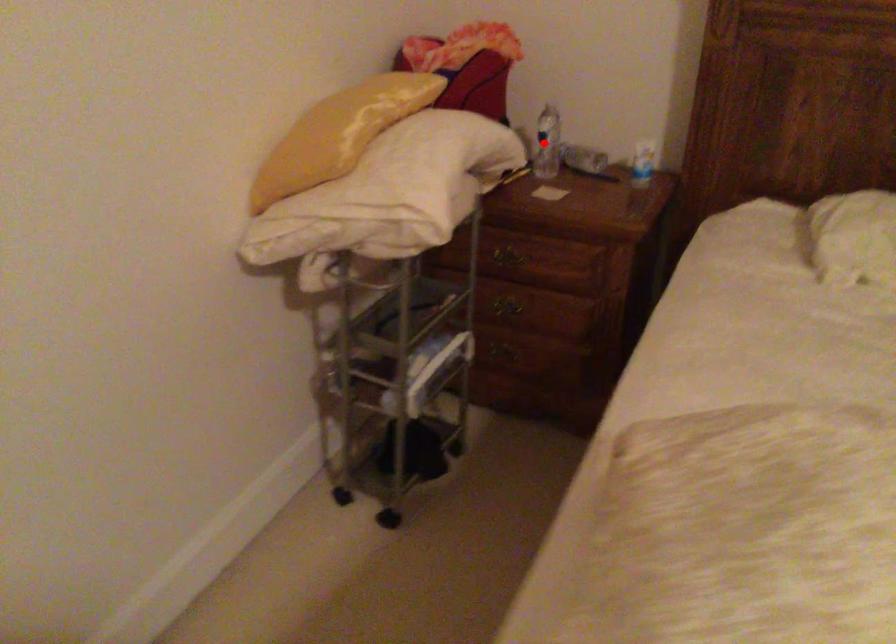
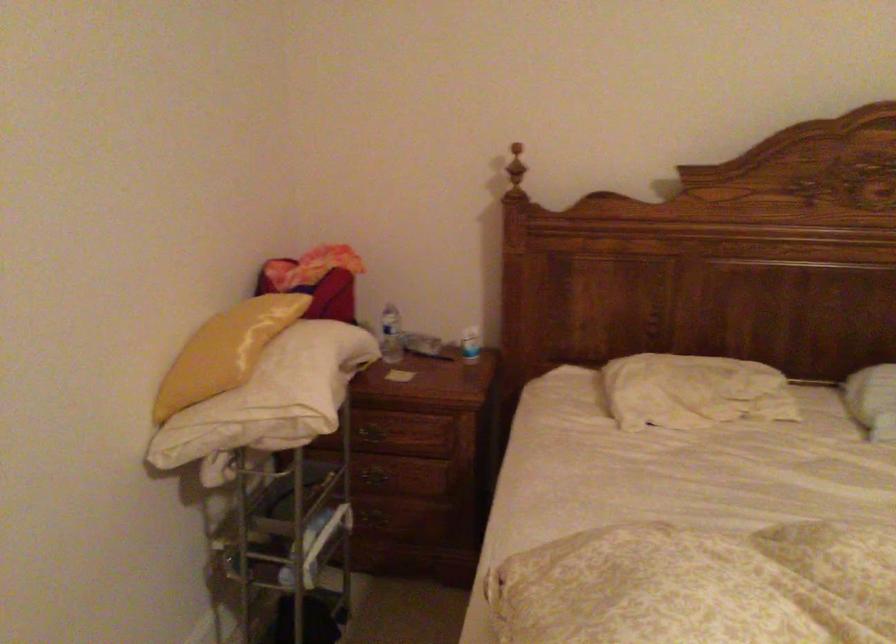
Question: I am providing you with two images of the same scene from different viewpoints. Image1 has a red point marked. In image2, the corresponding 3D location appears at what relative position? Reply with the corresponding letter.

Choices:
 (A) Closer
 (B) Farther

Answer: (B)